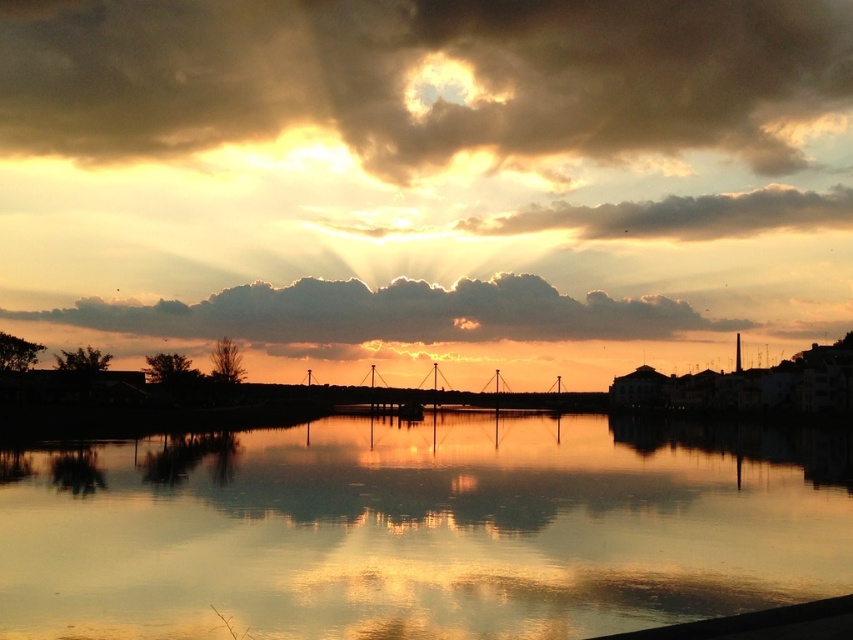
Question: Among these objects, which one is nearest to the camera?

Choices:
 (A) dark gray cloud at upper center
 (B) cloudy sky at upper center

Answer: (A)

Question: Is silky smooth water at center above cloudy sky at center?

Choices:
 (A) no
 (B) yes

Answer: (A)

Question: Considering the real-world distances, which object is closest to the dark gray cloud at upper center?

Choices:
 (A) silky smooth water at center
 (B) cloudy sky at upper center

Answer: (B)

Question: Is cloudy sky at upper center to the left of cloudy sky at center from the viewer's perspective?

Choices:
 (A) yes
 (B) no

Answer: (B)

Question: Which object appears farthest from the camera in this image?

Choices:
 (A) silky smooth water at center
 (B) cloudy sky at upper center
 (C) dark gray cloud at upper center
 (D) cloudy sky at center

Answer: (B)

Question: Does cloudy sky at upper center have a lesser width compared to cloudy sky at center?

Choices:
 (A) yes
 (B) no

Answer: (B)